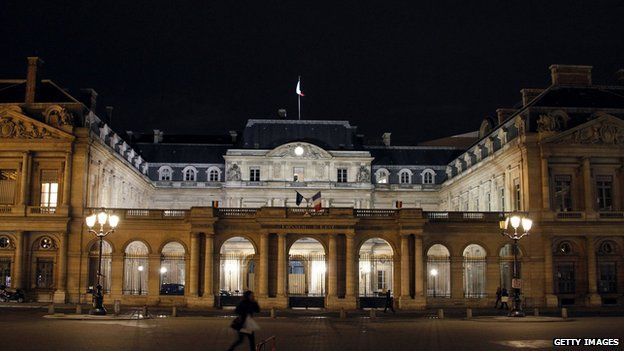
This screenshot has width=624, height=351. Identify the location of pillar. (281, 262).